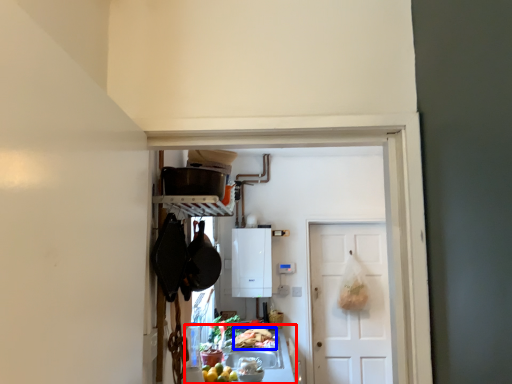
Question: Which of the following is the closest to the observer, counter top (highlighted by a red box) or food (highlighted by a blue box)?

Choices:
 (A) counter top
 (B) food

Answer: (A)